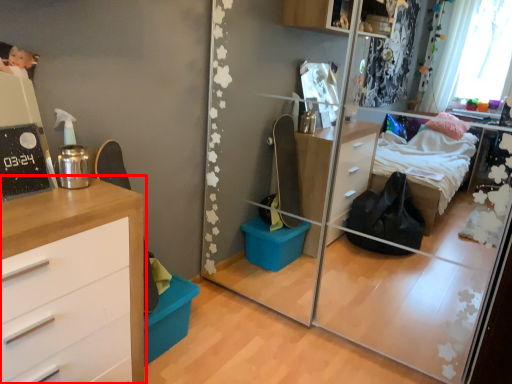
Question: Observing the image, what is the correct spatial positioning of chest of drawers (annotated by the red box) in reference to mirror?

Choices:
 (A) right
 (B) left

Answer: (B)